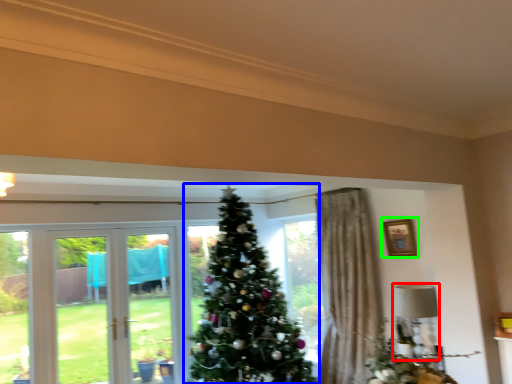
Question: Which object is the farthest from lamp (highlighted by a red box)? Choose among these: christmas tree (highlighted by a blue box) or picture frame (highlighted by a green box).

Choices:
 (A) christmas tree
 (B) picture frame

Answer: (A)